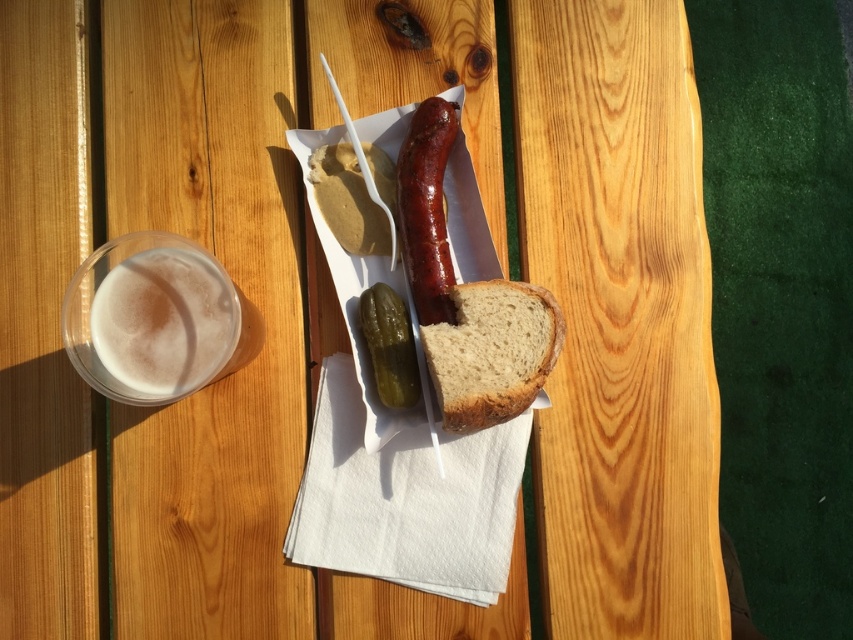
You are a food photographer setting up a shot for a mustard advertisement. You need to position the matte yellow mustard at center so that it is exactly 30 inches away from the camera. Currently, it is 28.54 inches away. Should you move it closer or farther away?

The matte yellow mustard at center is currently 28.54 inches from the camera. To reach the desired 30 inches, you need to move it farther away by 1.46 inches.

You are a food critic evaluating the meal on the table. Which item is larger between the brown crusty bread at center and the shiny brown sausage at center?

The brown crusty bread at center is bigger than the shiny brown sausage at center.